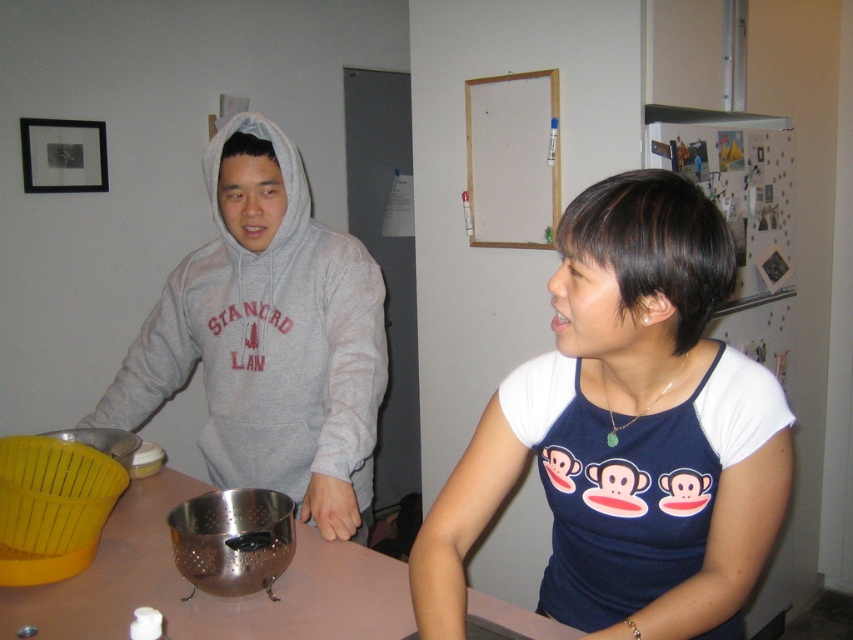
Does gray hoodie at left have a lesser height compared to metallic silver colander at center?

No.

Can you confirm if gray hoodie at left is positioned to the right of metallic silver colander at center?

Indeed, gray hoodie at left is positioned on the right side of metallic silver colander at center.

Which is in front, point (720, 600) or point (384, 561)?

Point (720, 600) is in front.

This screenshot has height=640, width=853. Identify the location of gray hoodie at left. (627, 433).

Can you confirm if blue fabric shirt at center is shorter than gray fleece hoodie at left?

Yes.

Can you confirm if blue fabric shirt at center is positioned to the right of gray fleece hoodie at left?

Correct, you'll find blue fabric shirt at center to the right of gray fleece hoodie at left.

Which is behind, point (699, 442) or point (302, 280)?

The point (302, 280) is behind.

You are a GUI agent. You are given a task and a screenshot of the screen. Output one action in this format:
    pyautogui.click(x=<x>, y=<y>)
    Task: Click on the blue fabric shirt at center
    The width and height of the screenshot is (853, 640).
    Given the screenshot: What is the action you would take?
    pyautogui.click(x=627, y=433)

Is blue fabric shirt at center wider than metallic silver colander at center?

In fact, blue fabric shirt at center might be narrower than metallic silver colander at center.

Can you confirm if blue fabric shirt at center is shorter than metallic silver colander at center?

Incorrect, blue fabric shirt at center's height does not fall short of metallic silver colander at center's.

Does point (459, 509) come closer to viewer compared to point (71, 577)?

Yes, point (459, 509) is in front of point (71, 577).

Identify the location of blue fabric shirt at center. This screenshot has height=640, width=853. [x=627, y=433].